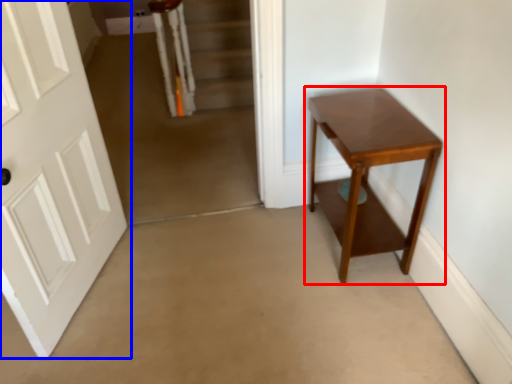
Question: Which object appears closest to the camera in this image, table (highlighted by a red box) or door (highlighted by a blue box)?

Choices:
 (A) table
 (B) door

Answer: (B)